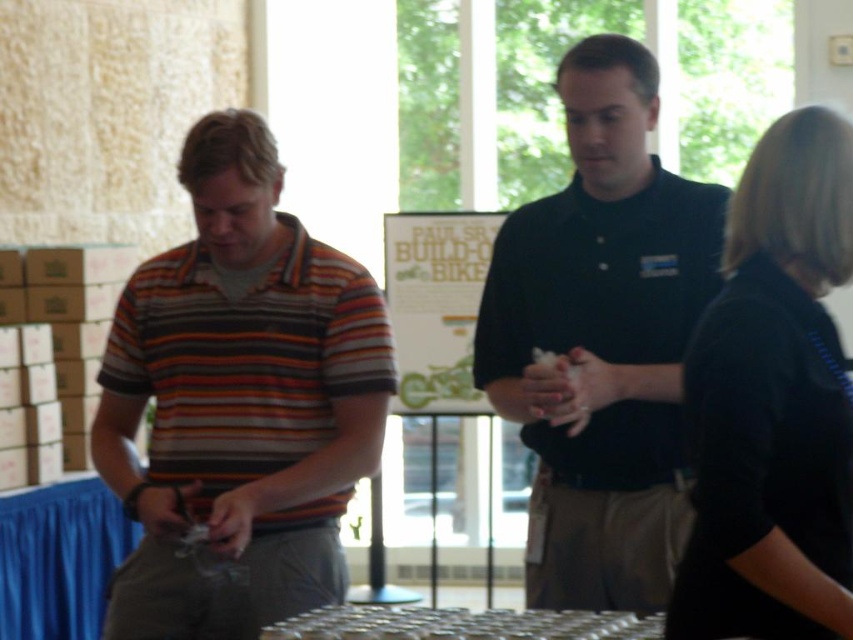
Is point (561, 266) positioned after point (770, 296)?

Yes, it is.

Does dark blue shirt at center appear over black matte shirt at right?

Yes.

Which is behind, point (573, 304) or point (733, 460)?

Positioned behind is point (573, 304).

Where is `dark blue shirt at center`? The height and width of the screenshot is (640, 853). dark blue shirt at center is located at coordinates (601, 340).

Is striped cotton shirt at left positioned at the back of black matte shirt at right?

Yes, striped cotton shirt at left is behind black matte shirt at right.

Does striped cotton shirt at left have a greater width compared to black matte shirt at right?

Yes, striped cotton shirt at left is wider than black matte shirt at right.

Is point (242, 291) positioned before point (753, 465)?

No, it is not.

The image size is (853, 640). I want to click on striped cotton shirt at left, so click(239, 401).

Does striped cotton shirt at left have a lesser height compared to metallic silver table at lower center?

No, striped cotton shirt at left is not shorter than metallic silver table at lower center.

Between striped cotton shirt at left and metallic silver table at lower center, which one has more height?

Standing taller between the two is striped cotton shirt at left.

Who is more forward, (293, 568) or (509, 621)?

Point (509, 621)

Identify the location of striped cotton shirt at left. (239, 401).